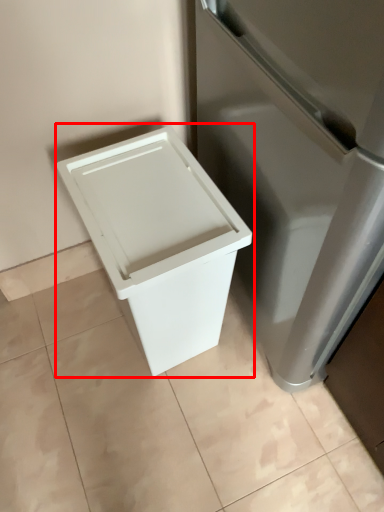
Question: From the image, what is the correct spatial relationship of waste container (annotated by the red box) in relation to tile?

Choices:
 (A) right
 (B) left

Answer: (A)